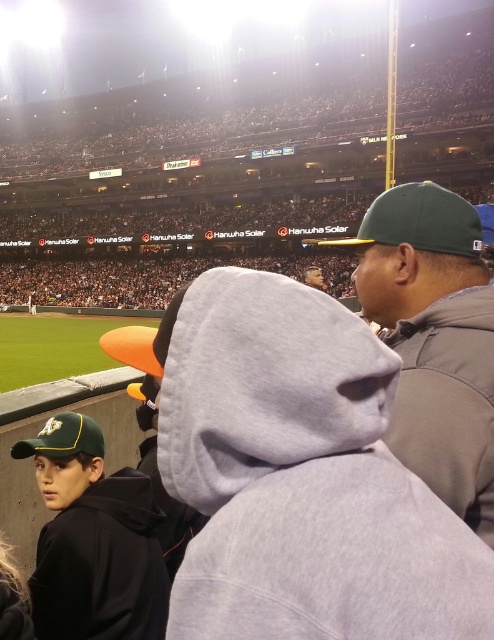
Can you confirm if green fabric baseball cap at upper right is positioned below green matte baseball cap at lower left?

No, green fabric baseball cap at upper right is not below green matte baseball cap at lower left.

Between point (440, 227) and point (100, 433), which one is positioned in front?

Positioned in front is point (440, 227).

Locate an element on the screen. green fabric baseball cap at upper right is located at coordinates (419, 220).

Who is taller, green fabric cap at upper right or green fabric baseball cap at upper right?

green fabric baseball cap at upper right is taller.

Is green fabric cap at upper right above green fabric baseball cap at upper right?

Actually, green fabric cap at upper right is below green fabric baseball cap at upper right.

This screenshot has height=640, width=494. I want to click on green fabric cap at upper right, so click(435, 339).

What are the coordinates of `green fabric cap at upper right` in the screenshot? It's located at pyautogui.click(x=435, y=339).

Based on the photo, does matte black hoodie at lower left appear under green fabric baseball cap at upper right?

Correct, matte black hoodie at lower left is located below green fabric baseball cap at upper right.

What do you see at coordinates (93, 540) in the screenshot? Image resolution: width=494 pixels, height=640 pixels. I see `matte black hoodie at lower left` at bounding box center [93, 540].

Between point (93, 529) and point (462, 250), which one is positioned in front?

Point (462, 250) is in front.

This screenshot has height=640, width=494. I want to click on matte black hoodie at lower left, so click(93, 540).